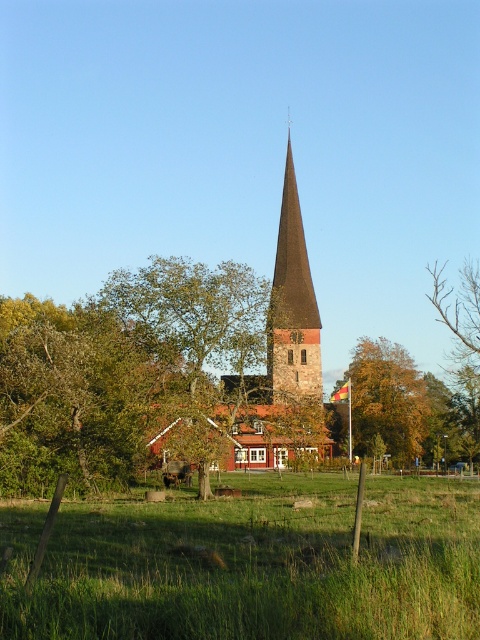
Which is more to the left, green leafy tree at left or dark brown stone spire at center?

From the viewer's perspective, green leafy tree at left appears more on the left side.

Who is higher up, green leafy tree at left or dark brown stone spire at center?

dark brown stone spire at center

I want to click on green leafy tree at left, so tap(66, 397).

This screenshot has height=640, width=480. Identify the location of green leafy tree at left. (66, 397).

Between point (241, 378) and point (229, 454), which one is positioned behind?

The point (229, 454) is behind.

Does point (142, 275) come closer to viewer compared to point (308, 445)?

Yes, it is in front of point (308, 445).

The height and width of the screenshot is (640, 480). Find the location of `green leafy tree at center`. green leafy tree at center is located at coordinates (194, 340).

Can you confirm if green grass at center is wider than green leafy tree at center?

Yes, green grass at center is wider than green leafy tree at center.

Can you confirm if green grass at center is thinner than green leafy tree at center?

No.

Between point (16, 518) and point (137, 284), which one is positioned in front?

Point (16, 518)

Image resolution: width=480 pixels, height=640 pixels. In order to click on green grass at center in this screenshot , I will do 252,564.